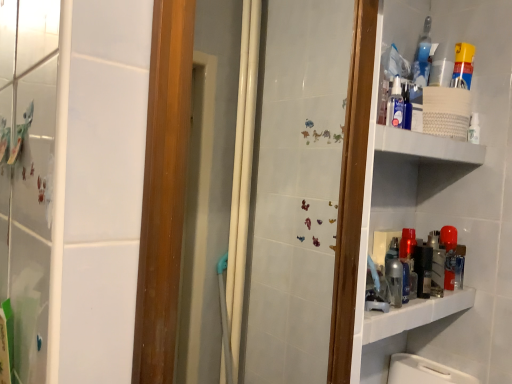
At what (x,y) coordinates should I click in order to perform the action: click on white textured shelf at upper right. Please return your answer as a coordinate pair (x, y). Looking at the image, I should click on (426, 146).

What do you see at coordinates (426, 146) in the screenshot? I see `white textured shelf at upper right` at bounding box center [426, 146].

Locate an element on the screen. blue glass bottle at upper right is located at coordinates (422, 56).

From the image's perspective, is white textured shelf at upper right on blue glass bottle at upper right?

Actually, white textured shelf at upper right appears below blue glass bottle at upper right in the image.

Which object is wider, white textured shelf at upper right or blue glass bottle at upper right?

With larger width is white textured shelf at upper right.

Is white textured shelf at upper right far from blue glass bottle at upper right?

They are positioned close to each other.

Considering the relative positions of white textured shelf at upper right and blue glass bottle at upper right in the image provided, is white textured shelf at upper right in front of blue glass bottle at upper right?

That is True.

From a real-world perspective, relative to white textured shelf at upper right, is yellow plastic spray can at upper right vertically above or below?

Clearly, from a real-world perspective, yellow plastic spray can at upper right is above white textured shelf at upper right.

How different are the orientations of yellow plastic spray can at upper right and white textured shelf at upper right in degrees?

yellow plastic spray can at upper right and white textured shelf at upper right are facing 0.00124 degrees away from each other.

Find the location of `cleaning product that appears on the right of white textured shelf at upper right`. cleaning product that appears on the right of white textured shelf at upper right is located at coordinates (463, 65).

From the image's perspective, who appears lower, yellow plastic spray can at upper right or white textured shelf at upper right?

From the image's view, white textured shelf at upper right is below.

How many degrees apart are the facing directions of blue glass bottle at upper right and yellow plastic spray can at upper right?

The angle between the facing direction of blue glass bottle at upper right and the facing direction of yellow plastic spray can at upper right is 0.000594 degrees.

Could you tell me if blue glass bottle at upper right is facing yellow plastic spray can at upper right?

Yes.

Considering the relative positions of blue glass bottle at upper right and yellow plastic spray can at upper right in the image provided, is blue glass bottle at upper right to the left or to the right of yellow plastic spray can at upper right?

blue glass bottle at upper right is positioned on yellow plastic spray can at upper right's left side.

From the picture: Considering the sizes of objects blue glass bottle at upper right and yellow plastic spray can at upper right in the image provided, who is bigger, blue glass bottle at upper right or yellow plastic spray can at upper right?

yellow plastic spray can at upper right.

From a real-world perspective, which is physically above, yellow plastic spray can at upper right or blue glass bottle at upper right?

blue glass bottle at upper right, from a real-world perspective.

Is yellow plastic spray can at upper right oriented towards blue glass bottle at upper right?

No.

Does yellow plastic spray can at upper right touch blue glass bottle at upper right?

Yes, the surface of yellow plastic spray can at upper right is in contact with blue glass bottle at upper right.

From a real-world perspective, is blue glass bottle at upper right located beneath white textured shelf at upper right?

No, from a real-world perspective, blue glass bottle at upper right is not under white textured shelf at upper right.

Based on the photo, considering their positions, is blue glass bottle at upper right located in front of or behind white textured shelf at upper right?

blue glass bottle at upper right is positioned farther from the viewer than white textured shelf at upper right.

In the image, is blue glass bottle at upper right on the left side or the right side of white textured shelf at upper right?

Based on their positions, blue glass bottle at upper right is located to the right of white textured shelf at upper right.

The image size is (512, 384). Identify the location of cleaning product positioned vertically above the white textured shelf at upper right (from a real-world perspective). (463, 65).

Is white textured shelf at upper right turned away from yellow plastic spray can at upper right?

white textured shelf at upper right does not have its back to yellow plastic spray can at upper right.

Is point (431, 145) positioned in front of point (457, 71)?

Yes, point (431, 145) is in front of point (457, 71).

Which object is thinner, white textured shelf at upper right or yellow plastic spray can at upper right?

With smaller width is yellow plastic spray can at upper right.

This screenshot has height=384, width=512. I want to click on shelve on the left of blue glass bottle at upper right, so click(426, 146).

Identify the location of shelve that is under the yellow plastic spray can at upper right (from a real-world perspective). (426, 146).

Considering their positions, is yellow plastic spray can at upper right positioned further to white textured shelf at upper right than blue glass bottle at upper right?

blue glass bottle at upper right is further to white textured shelf at upper right.

Based on their spatial positions, is white textured shelf at upper right or yellow plastic spray can at upper right further from blue glass bottle at upper right?

The object further to blue glass bottle at upper right is white textured shelf at upper right.

When comparing their distances from yellow plastic spray can at upper right, does blue glass bottle at upper right or white textured shelf at upper right seem further?

white textured shelf at upper right is further to yellow plastic spray can at upper right.

Based on their spatial positions, is white textured shelf at upper right or blue glass bottle at upper right closer to yellow plastic spray can at upper right?

Based on the image, blue glass bottle at upper right appears to be nearer to yellow plastic spray can at upper right.

Based on their spatial positions, is yellow plastic spray can at upper right or white textured shelf at upper right further from blue glass bottle at upper right?

Among the two, white textured shelf at upper right is located further to blue glass bottle at upper right.

Based on their spatial positions, is blue glass bottle at upper right or yellow plastic spray can at upper right further from white textured shelf at upper right?

The object further to white textured shelf at upper right is blue glass bottle at upper right.

Locate an element on the screen. Image resolution: width=512 pixels, height=384 pixels. cleaning product between blue glass bottle at upper right and white textured shelf at upper right from top to bottom is located at coordinates (463, 65).